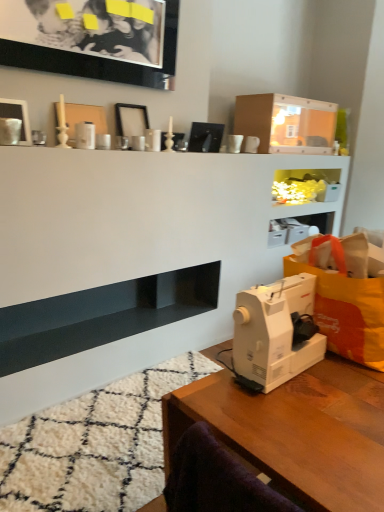
Question: From a real-world perspective, does matte cardboard box at upper center sit lower than black glossy picture frame at upper left, marked as the 3th picture frame in a bottom-to-top arrangement?

Choices:
 (A) yes
 (B) no

Answer: (A)

Question: Considering the relative sizes of matte cardboard box at upper center and black glossy picture frame at upper left, the first picture frame viewed from the top, in the image provided, is matte cardboard box at upper center taller than black glossy picture frame at upper left, the first picture frame viewed from the top,?

Choices:
 (A) yes
 (B) no

Answer: (B)

Question: Considering the relative sizes of matte cardboard box at upper center and black glossy picture frame at upper left, marked as the 3th picture frame in a bottom-to-top arrangement, in the image provided, is matte cardboard box at upper center bigger than black glossy picture frame at upper left, marked as the 3th picture frame in a bottom-to-top arrangement,?

Choices:
 (A) no
 (B) yes

Answer: (B)

Question: Is matte cardboard box at upper center aimed at black glossy picture frame at upper left, the first picture frame viewed from the top?

Choices:
 (A) yes
 (B) no

Answer: (B)

Question: Considering the relative positions of matte cardboard box at upper center and black glossy picture frame at upper left, the first picture frame viewed from the top, in the image provided, is matte cardboard box at upper center in front of black glossy picture frame at upper left, the first picture frame viewed from the top,?

Choices:
 (A) no
 (B) yes

Answer: (A)

Question: From a real-world perspective, relative to wooden table at lower right, is orange fabric grocery bag at right vertically above or below?

Choices:
 (A) above
 (B) below

Answer: (A)

Question: Considering the positions of orange fabric grocery bag at right and wooden table at lower right in the image, is orange fabric grocery bag at right bigger or smaller than wooden table at lower right?

Choices:
 (A) big
 (B) small

Answer: (B)

Question: From the image's perspective, is orange fabric grocery bag at right positioned above or below wooden table at lower right?

Choices:
 (A) below
 (B) above

Answer: (B)

Question: From their relative heights in the image, would you say orange fabric grocery bag at right is taller or shorter than wooden table at lower right?

Choices:
 (A) tall
 (B) short

Answer: (B)

Question: In terms of height, does matte cardboard box at upper center look taller or shorter compared to wooden table at lower right?

Choices:
 (A) short
 (B) tall

Answer: (A)

Question: Is matte cardboard box at upper center wider or thinner than wooden table at lower right?

Choices:
 (A) wide
 (B) thin

Answer: (B)

Question: Considering the positions of matte cardboard box at upper center and wooden table at lower right in the image, is matte cardboard box at upper center bigger or smaller than wooden table at lower right?

Choices:
 (A) small
 (B) big

Answer: (A)

Question: In the image, is matte cardboard box at upper center on the left side or the right side of wooden table at lower right?

Choices:
 (A) left
 (B) right

Answer: (B)

Question: From a real-world perspective, is white glossy picture frame at upper left, the 1th picture frame in the bottom-to-top sequence, above or below wooden table at lower right?

Choices:
 (A) below
 (B) above

Answer: (B)

Question: From the image's perspective, is white glossy picture frame at upper left, the 1th picture frame in the bottom-to-top sequence, positioned above or below wooden table at lower right?

Choices:
 (A) above
 (B) below

Answer: (A)